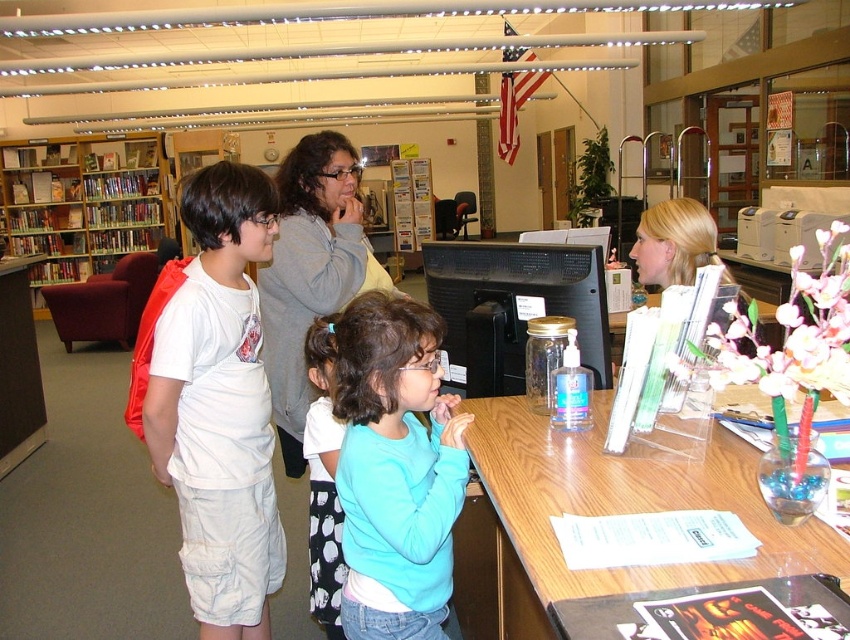
Does light blue sweater at center have a lesser width compared to wooden bookshelf at left?

Yes, light blue sweater at center is thinner than wooden bookshelf at left.

Consider the image. Is light blue sweater at center closer to camera compared to wooden bookshelf at left?

That is True.

Find the location of a particular element. This screenshot has width=850, height=640. light blue sweater at center is located at coordinates (x=395, y=468).

Does gray sweater at center have a greater width compared to blonde hair at upper center?

Yes.

Who is positioned more to the right, gray sweater at center or blonde hair at upper center?

blonde hair at upper center

Is point (298, 362) farther from viewer compared to point (697, 202)?

No, (298, 362) is in front of (697, 202).

In order to click on gray sweater at center in this screenshot , I will do `click(310, 272)`.

Does light blue sweater at center have a greater height compared to blue fabric skirt at lower center?

In fact, light blue sweater at center may be shorter than blue fabric skirt at lower center.

Find the location of `light blue sweater at center`. light blue sweater at center is located at coordinates (395, 468).